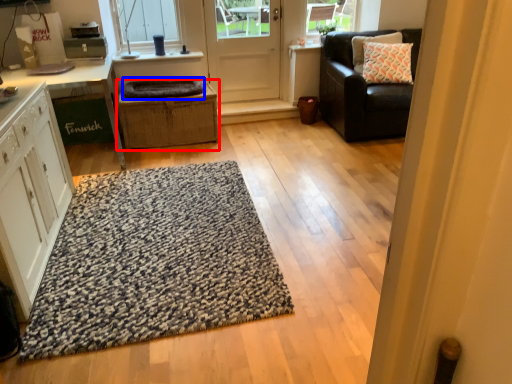
Question: Among these objects, which one is farthest to the camera, crate (highlighted by a red box) or blanket (highlighted by a blue box)?

Choices:
 (A) crate
 (B) blanket

Answer: (B)